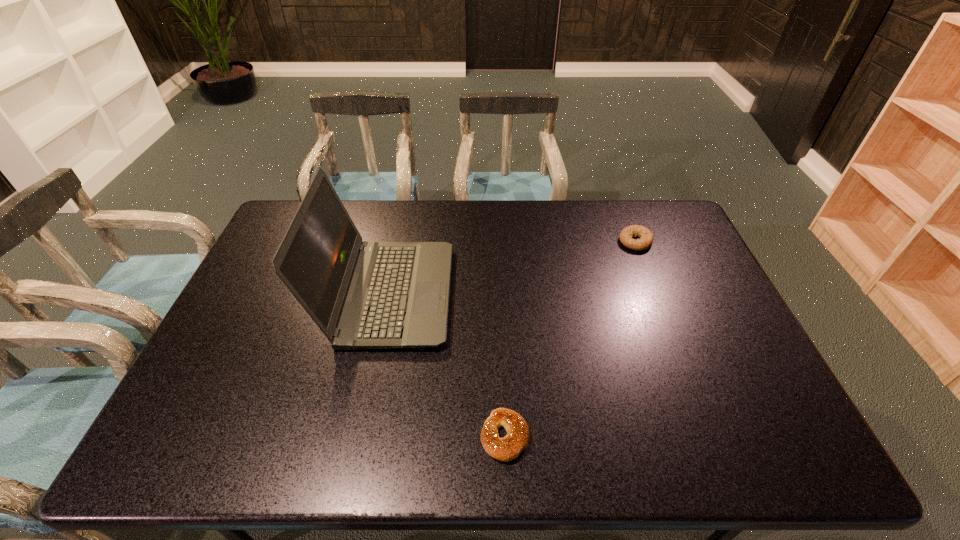
Where is `object at the near edge`? object at the near edge is located at coordinates (508, 448).

This screenshot has height=540, width=960. In order to click on object situated at the right edge in this screenshot , I will do `click(646, 239)`.

The width and height of the screenshot is (960, 540). In order to click on object that is at the far right corner in this screenshot , I will do `click(646, 239)`.

Where is `free space at the far edge of the desktop`? free space at the far edge of the desktop is located at coordinates (571, 203).

This screenshot has width=960, height=540. In order to click on blank space at the near edge in this screenshot , I will do [x=501, y=462].

Image resolution: width=960 pixels, height=540 pixels. In the image, there is a desktop. Find the location of `vacant space at the left edge`. vacant space at the left edge is located at coordinates (237, 343).

You are a GUI agent. You are given a task and a screenshot of the screen. Output one action in this format:
    pyautogui.click(x=<x>, y=<y>)
    Task: Click on the vacant space at the far right corner of the desktop
    The image size is (960, 540).
    Given the screenshot: What is the action you would take?
    pyautogui.click(x=653, y=210)

Find the location of `free space that is in between the laptop_computer and the right bagel`. free space that is in between the laptop_computer and the right bagel is located at coordinates (512, 268).

Identify the location of vacant space that's between the tallest object and the right bagel. The width and height of the screenshot is (960, 540). (512, 268).

This screenshot has width=960, height=540. Find the location of `empty space between the farther bagel and the second object from right to left`. empty space between the farther bagel and the second object from right to left is located at coordinates (570, 339).